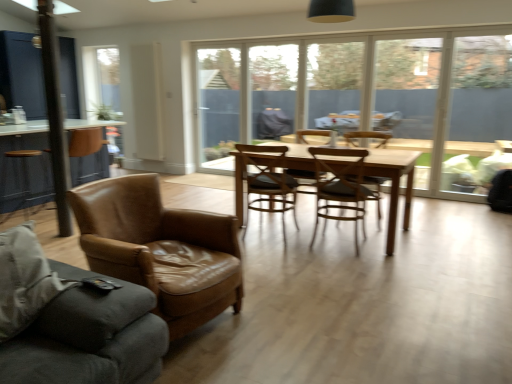
I want to click on free space on the front side of wooden chair at center, the second chair when ordered from front to back, so click(350, 261).